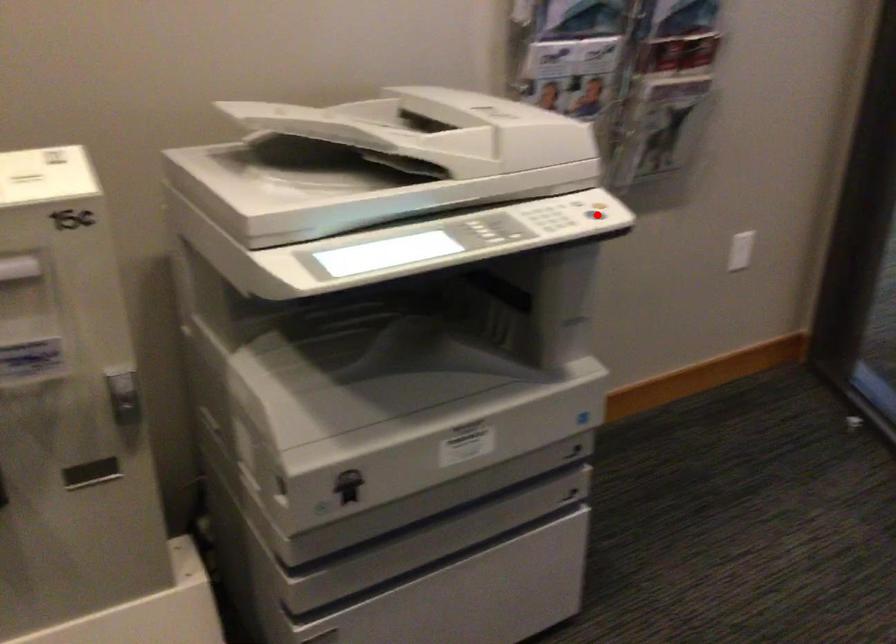
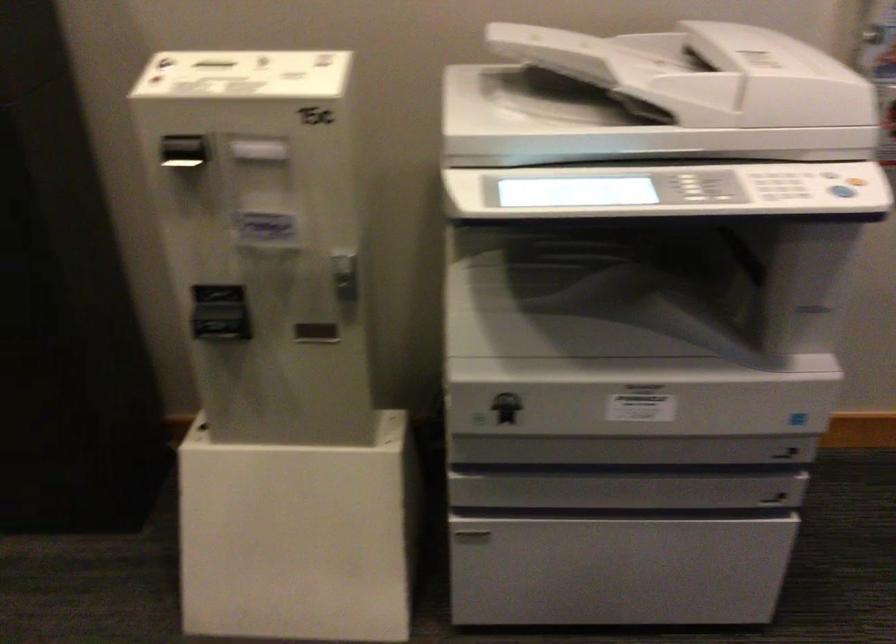
Find the pixel in the second image that matches the highlighted location in the first image.

(841, 191)